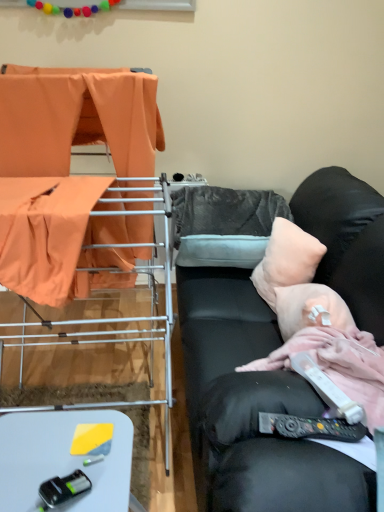
Question: Should I look upward or downward to see black plastic toy car at lower left, the 1th equipment ordered from the bottom?

Choices:
 (A) down
 (B) up

Answer: (A)

Question: Does metal drying rack at left, the 2th furniture from the back, have a lesser height compared to black plastic toy car at lower left, acting as the 2th equipment starting from the top?

Choices:
 (A) no
 (B) yes

Answer: (A)

Question: Is metal drying rack at left, the 2th furniture from the back, smaller than black plastic toy car at lower left, acting as the 2th equipment starting from the top?

Choices:
 (A) no
 (B) yes

Answer: (A)

Question: Is the position of metal drying rack at left, which ranks as the 1th furniture in front-to-back order, less distant than that of black plastic toy car at lower left, which is the 1th equipment in left-to-right order?

Choices:
 (A) no
 (B) yes

Answer: (B)

Question: Is metal drying rack at left, which ranks as the 1th furniture in front-to-back order, at the left side of black plastic toy car at lower left, which is the 1th equipment in left-to-right order?

Choices:
 (A) yes
 (B) no

Answer: (A)

Question: Can you confirm if metal drying rack at left, the 2th furniture from the back, is positioned to the right of black plastic toy car at lower left, the 1th equipment ordered from the bottom?

Choices:
 (A) no
 (B) yes

Answer: (A)

Question: Is metal drying rack at left, which ranks as the 1th furniture in front-to-back order, completely or partially outside of black plastic toy car at lower left, the second equipment viewed from the right?

Choices:
 (A) yes
 (B) no

Answer: (A)

Question: From the image's perspective, is white plastic remote control at lower right, which is the second equipment in left-to-right order, located beneath gray fuzzy pillow at center, the second pillow in the front-to-back sequence?

Choices:
 (A) no
 (B) yes

Answer: (B)

Question: From a real-world perspective, is white plastic remote control at lower right, the 2th equipment in the bottom-to-top sequence, positioned over gray fuzzy pillow at center, the second pillow in the front-to-back sequence, based on gravity?

Choices:
 (A) no
 (B) yes

Answer: (B)

Question: Does white plastic remote control at lower right, which appears as the 1th equipment when viewed from the top, have a greater height compared to gray fuzzy pillow at center, which is the 1th pillow in back-to-front order?

Choices:
 (A) yes
 (B) no

Answer: (B)

Question: Is white plastic remote control at lower right, which is the first equipment in right-to-left order, positioned beyond the bounds of gray fuzzy pillow at center, which is the 1th pillow in back-to-front order?

Choices:
 (A) no
 (B) yes

Answer: (B)

Question: Can you confirm if white plastic remote control at lower right, the 2th equipment in the bottom-to-top sequence, is positioned to the right of gray fuzzy pillow at center, which is the 1th pillow in back-to-front order?

Choices:
 (A) yes
 (B) no

Answer: (A)

Question: Does white plastic remote control at lower right, which appears as the 1th equipment when viewed from the top, lie in front of gray fuzzy pillow at center, which is the 1th pillow in back-to-front order?

Choices:
 (A) yes
 (B) no

Answer: (A)

Question: Can you confirm if peachy soft pillow at right, the 1th pillow from the front, is positioned to the right of white plastic table at lower left?

Choices:
 (A) yes
 (B) no

Answer: (A)